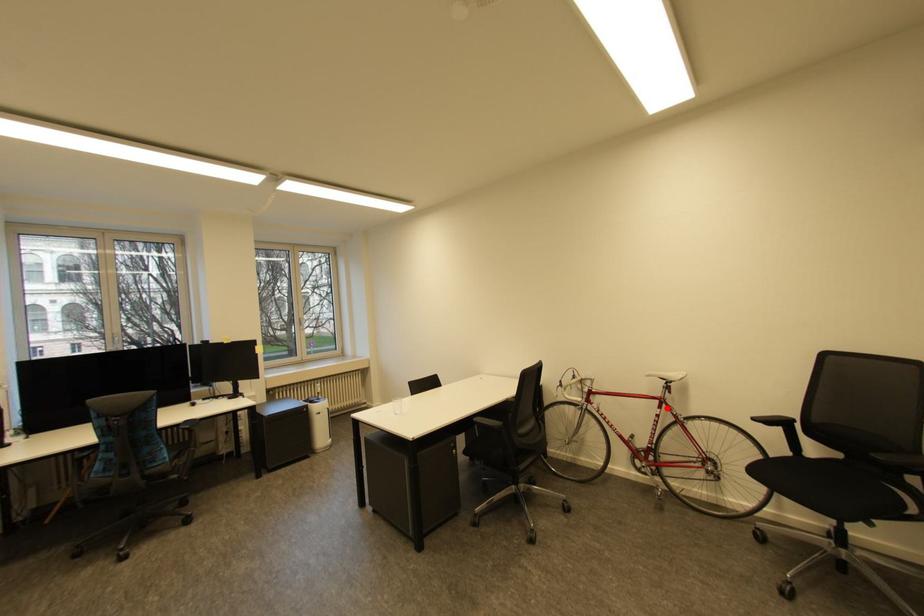
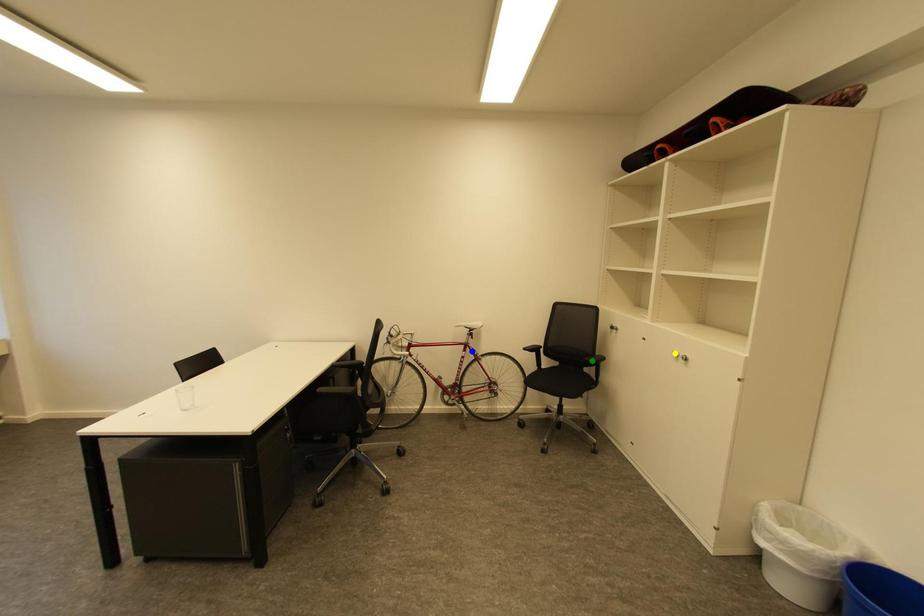
Question: I am providing you with two images of the same scene from different viewpoints. A red point is marked on the first image. You are given multiple points on the second image. Which mark in image 2 goes with the point in image 1?

Choices:
 (A) green point
 (B) yellow point
 (C) blue point

Answer: (C)